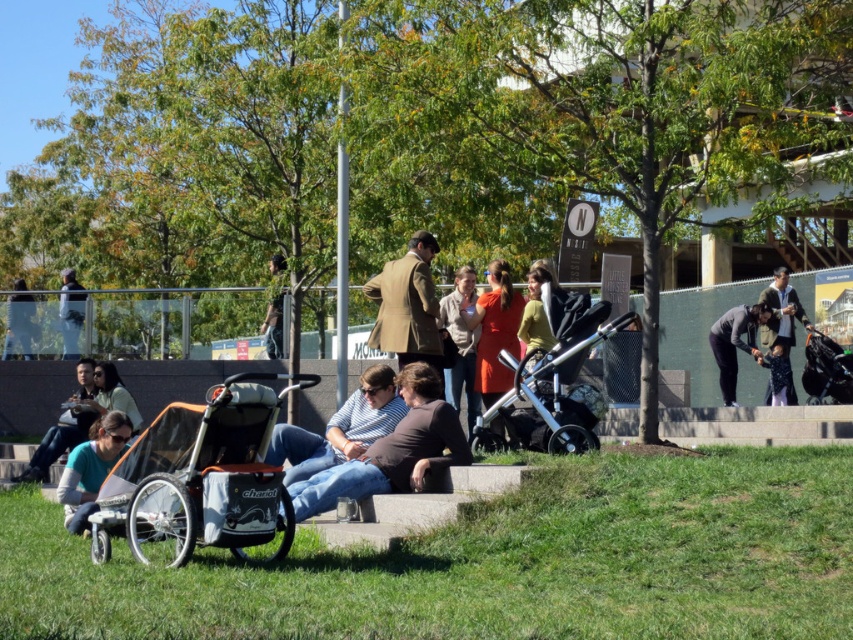
Question: Which point appears farthest from the camera in this image?

Choices:
 (A) (822, 564)
 (B) (769, 289)
 (C) (456, 394)

Answer: (B)

Question: Which object is farther from the camera taking this photo?

Choices:
 (A) matte black jacket at lower left
 (B) silver metallic stroller at center
 (C) dark gray fabric jacket at lower right

Answer: (C)

Question: Does orange fabric stroller at lower left have a lesser width compared to dark gray fabric jacket at lower right?

Choices:
 (A) yes
 (B) no

Answer: (B)

Question: Can you confirm if brown wool coat at center is positioned to the right of matte orange dress at center?

Choices:
 (A) no
 (B) yes

Answer: (A)

Question: Is green grass at lower left smaller than dark gray jacket at upper right?

Choices:
 (A) no
 (B) yes

Answer: (B)

Question: Which object appears closest to the camera in this image?

Choices:
 (A) dark gray fabric jacket at lower right
 (B) silver metallic stroller at center

Answer: (B)